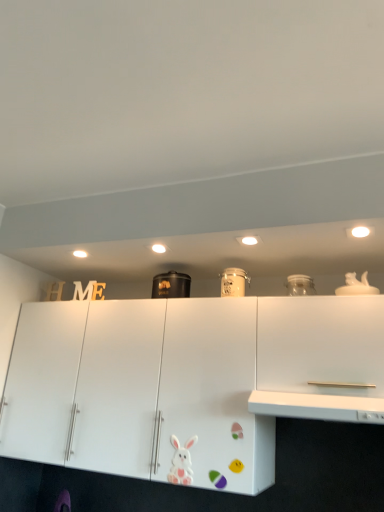
Question: In terms of size, does matte white jar at center, placed as the first appliance when sorted from right to left, appear bigger or smaller than black matte container at center, acting as the 2th appliance starting from the front?

Choices:
 (A) big
 (B) small

Answer: (B)

Question: Is matte white jar at center, placed as the first appliance when sorted from right to left, in front of or behind black matte container at center, acting as the 2th appliance starting from the front, in the image?

Choices:
 (A) front
 (B) behind

Answer: (A)

Question: Which is nearer to the white matte cabinet at right?

Choices:
 (A) black matte container at center, marked as the first appliance in a back-to-front arrangement
 (B) white matte rabbit at lower center
 (C) matte white jar at center, placed as the first appliance when sorted from front to back
 (D) white glossy counter top at center

Answer: (D)

Question: Which object is the closest to the matte white jar at center, placed as the first appliance when sorted from front to back?

Choices:
 (A) black matte container at center, acting as the 2th appliance starting from the front
 (B) white matte cabinet at right
 (C) white matte rabbit at lower center
 (D) white glossy counter top at center

Answer: (A)